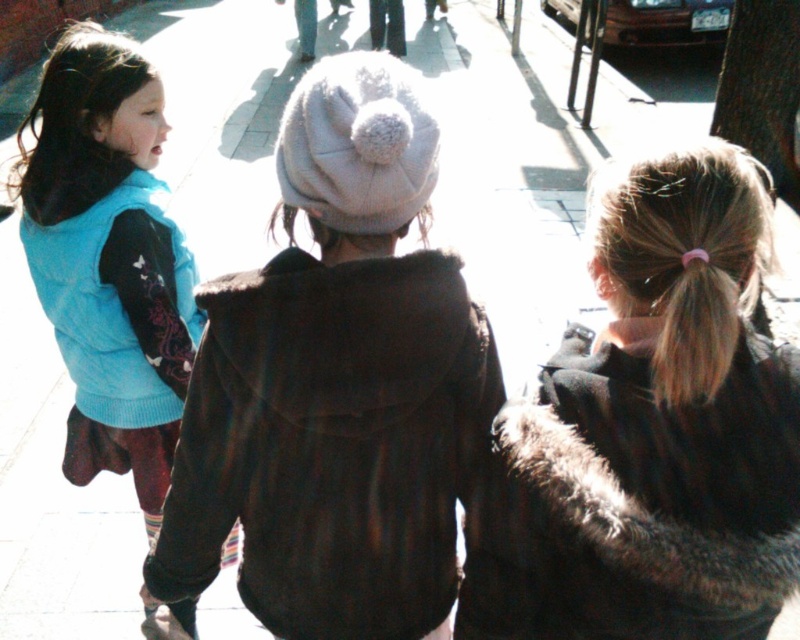
Is dark brown fur coat at center to the left of matte blue vest at left from the viewer's perspective?

No, dark brown fur coat at center is not to the left of matte blue vest at left.

Which is more to the right, dark brown fur coat at center or matte blue vest at left?

From the viewer's perspective, dark brown fur coat at center appears more on the right side.

Describe the element at coordinates (649, 432) in the screenshot. I see `dark brown fur coat at center` at that location.

You are a GUI agent. You are given a task and a screenshot of the screen. Output one action in this format:
    pyautogui.click(x=<x>, y=<y>)
    Task: Click on the dark brown fur coat at center
    This screenshot has height=640, width=800.
    Given the screenshot: What is the action you would take?
    pyautogui.click(x=649, y=432)

Who is positioned more to the left, matte blue vest at left or pink hair at center?

Positioned to the left is matte blue vest at left.

Measure the distance from matte blue vest at left to pink hair at center.

A distance of 29.18 inches exists between matte blue vest at left and pink hair at center.

Locate an element on the screen. matte blue vest at left is located at coordinates (110, 259).

The height and width of the screenshot is (640, 800). Find the location of `matte blue vest at left`. matte blue vest at left is located at coordinates (110, 259).

Which is in front, point (85, 269) or point (668, 289)?

Point (668, 289) is more forward.

Who is lower down, matte blue vest at left or blonde fur at upper right?

Positioned lower is matte blue vest at left.

Describe the element at coordinates (110, 259) in the screenshot. I see `matte blue vest at left` at that location.

The height and width of the screenshot is (640, 800). I want to click on matte blue vest at left, so click(110, 259).